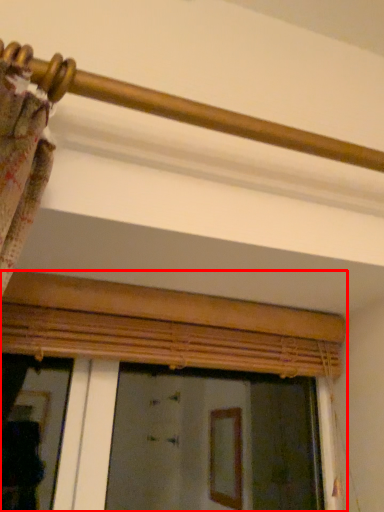
Question: Observing the image, what is the correct spatial positioning of window (annotated by the red box) in reference to rail?

Choices:
 (A) right
 (B) left

Answer: (B)